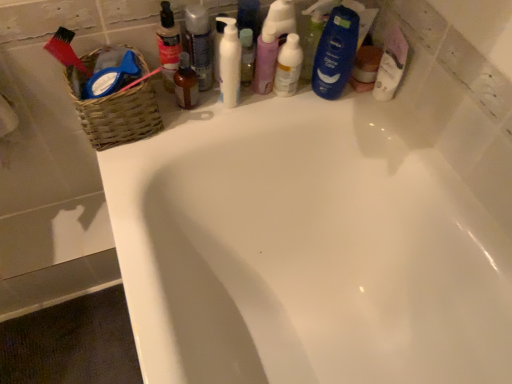
Find the location of a particular element. This screenshot has width=512, height=384. vacant point to the right of white glossy bottle at upper center is located at coordinates (343, 100).